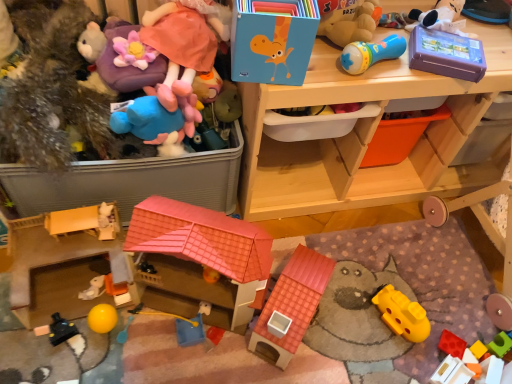
This screenshot has height=384, width=512. In order to click on vacant area located to the right-hand side of yellow rubber ball at lower left, the fourth toy from the left in this screenshot , I will do `click(153, 336)`.